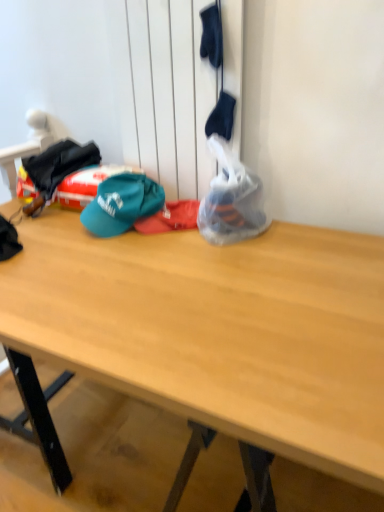
Question: Is translucent plastic bag at center further to the viewer compared to wooden desk at center?

Choices:
 (A) no
 (B) yes

Answer: (B)

Question: From the image's perspective, would you say translucent plastic bag at center is positioned over wooden desk at center?

Choices:
 (A) no
 (B) yes

Answer: (B)

Question: Is translucent plastic bag at center to the left of wooden desk at center from the viewer's perspective?

Choices:
 (A) yes
 (B) no

Answer: (B)

Question: Is translucent plastic bag at center oriented towards wooden desk at center?

Choices:
 (A) no
 (B) yes

Answer: (A)

Question: Is translucent plastic bag at center wider than wooden desk at center?

Choices:
 (A) no
 (B) yes

Answer: (A)

Question: Is translucent plastic bag at center thinner than wooden desk at center?

Choices:
 (A) no
 (B) yes

Answer: (B)

Question: From the image's perspective, does wooden desk at center appear higher than translucent plastic bag at center?

Choices:
 (A) yes
 (B) no

Answer: (B)

Question: Considering the relative sizes of wooden desk at center and translucent plastic bag at center in the image provided, is wooden desk at center smaller than translucent plastic bag at center?

Choices:
 (A) no
 (B) yes

Answer: (A)

Question: Is wooden desk at center shorter than translucent plastic bag at center?

Choices:
 (A) no
 (B) yes

Answer: (B)

Question: Is wooden desk at center positioned beyond the bounds of translucent plastic bag at center?

Choices:
 (A) no
 (B) yes

Answer: (B)

Question: Considering the relative positions of wooden desk at center and translucent plastic bag at center in the image provided, is wooden desk at center to the left of translucent plastic bag at center from the viewer's perspective?

Choices:
 (A) no
 (B) yes

Answer: (B)

Question: Does wooden desk at center turn towards translucent plastic bag at center?

Choices:
 (A) no
 (B) yes

Answer: (A)

Question: From the image's perspective, is wooden desk at center on top of teal fabric cap at center?

Choices:
 (A) no
 (B) yes

Answer: (A)